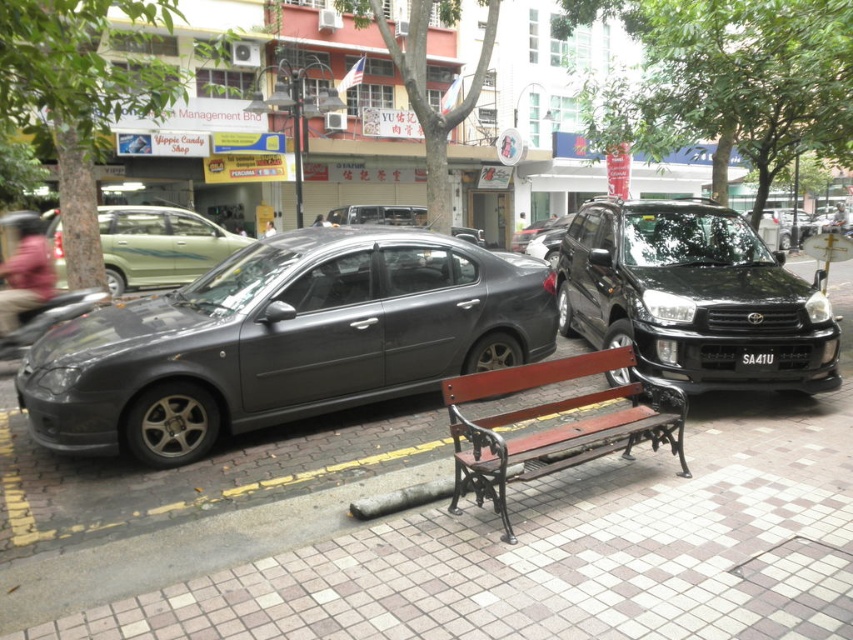
You are a pedestrian standing on the sidewalk. You see the brown tile pavement at center and the black plastic license plate at center. Which object is closer to you?

The brown tile pavement at center is closer to you because it is in front of the black plastic license plate at center.

You are standing at the camera position looking at the urban street scene. There are two points marked in the image, one at coordinates point (459, 545) and the other at point (769, 364). Which of these points is closer to you?

Point (459, 545) is closer to the camera than point (769, 364).

You are a pedestrian standing on the sidewalk near the red and black metal bench. You want to cross the street to reach the buildings in the background. Which of the parked cars, the black metallic sedan at right or the matte gray sedan at center, would you need to walk around first?

The black metallic sedan at right is in front of the matte gray sedan at center, so you would need to walk around the black metallic sedan at right first.